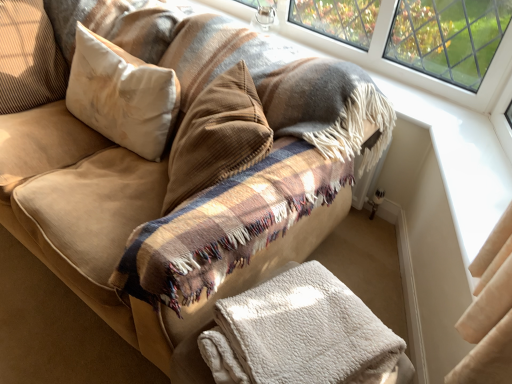
Question: Is suede-like beige pillow at upper left, which ranks as the 1th pillow in left-to-right order, inside or outside of white soft pillow at upper left, the first pillow positioned from the right?

Choices:
 (A) outside
 (B) inside

Answer: (A)

Question: In terms of height, does suede-like beige pillow at upper left, marked as the second pillow in a right-to-left arrangement, look taller or shorter compared to white soft pillow at upper left, the first pillow positioned from the right?

Choices:
 (A) short
 (B) tall

Answer: (B)

Question: Which object is the closest to the white fluffy blanket at lower center?

Choices:
 (A) suede-like beige pillow at upper left, which ranks as the 1th pillow in left-to-right order
 (B) white soft pillow at upper left, acting as the 2th pillow starting from the left

Answer: (B)

Question: Considering the real-world distances, which object is closest to the white fluffy blanket at lower center?

Choices:
 (A) white soft pillow at upper left, acting as the 2th pillow starting from the left
 (B) suede-like beige pillow at upper left, which ranks as the 1th pillow in left-to-right order

Answer: (A)